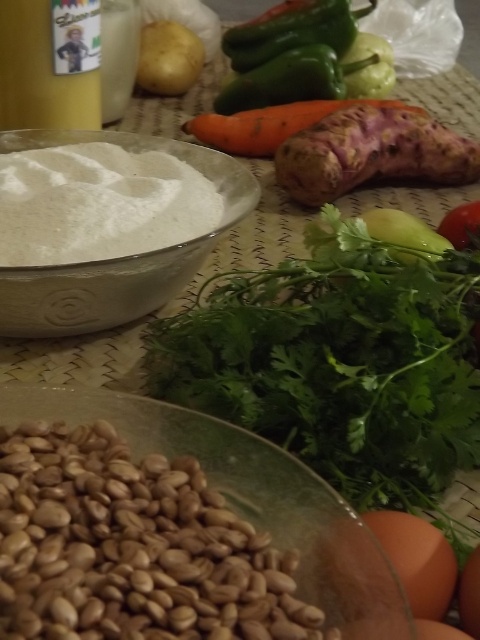
Question: Which point is farther to the camera?

Choices:
 (A) smooth yellow liquid at upper left
 (B) smooth brown egg at lower right
 (C) white powder at center

Answer: (A)

Question: Does orange matte egg at lower right have a larger size compared to orange matte carrot at center?

Choices:
 (A) no
 (B) yes

Answer: (A)

Question: Which of the following is the farthest from the observer?

Choices:
 (A) smooth yellow liquid at upper left
 (B) green matte pepper at upper center

Answer: (B)

Question: Which object is the closest to the smooth brown egg at lower right?

Choices:
 (A) smooth yellow potato at upper left
 (B) white powder at center
 (C) green matte pepper at upper center

Answer: (B)

Question: Is orange matte egg at lower right further to the viewer compared to orange matte carrot at center?

Choices:
 (A) yes
 (B) no

Answer: (B)

Question: Is smooth yellow liquid at upper left positioned at the back of green matte pepper at upper center?

Choices:
 (A) yes
 (B) no

Answer: (B)